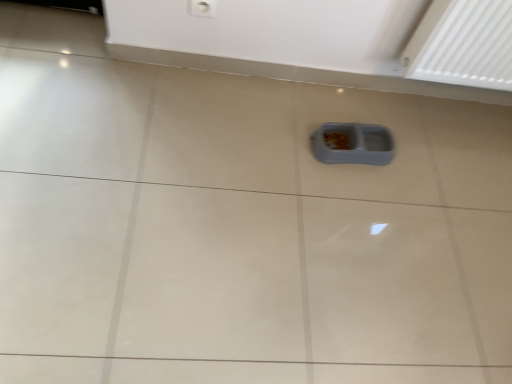
The height and width of the screenshot is (384, 512). What are the coordinates of `spots to the right of gray plastic food container at center` in the screenshot? It's located at (396, 176).